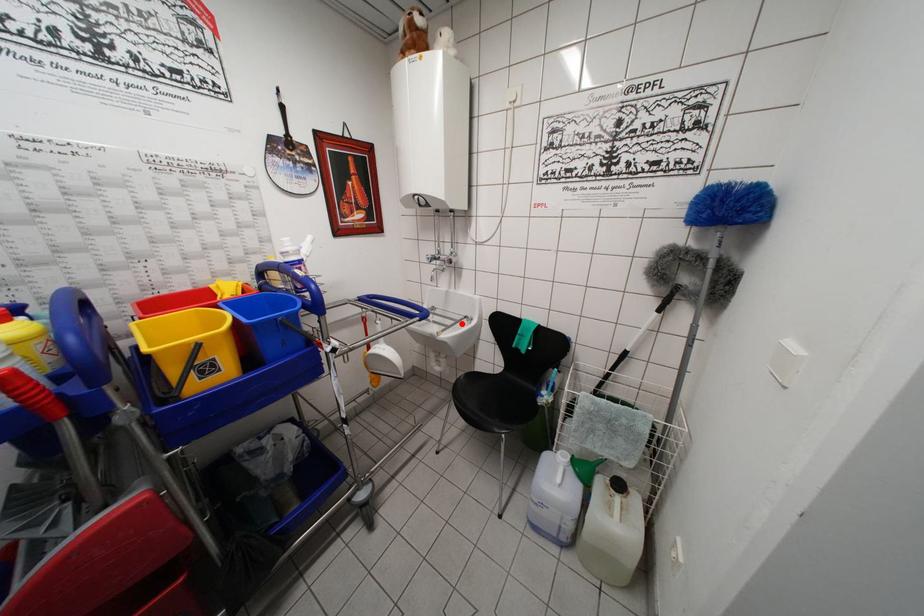
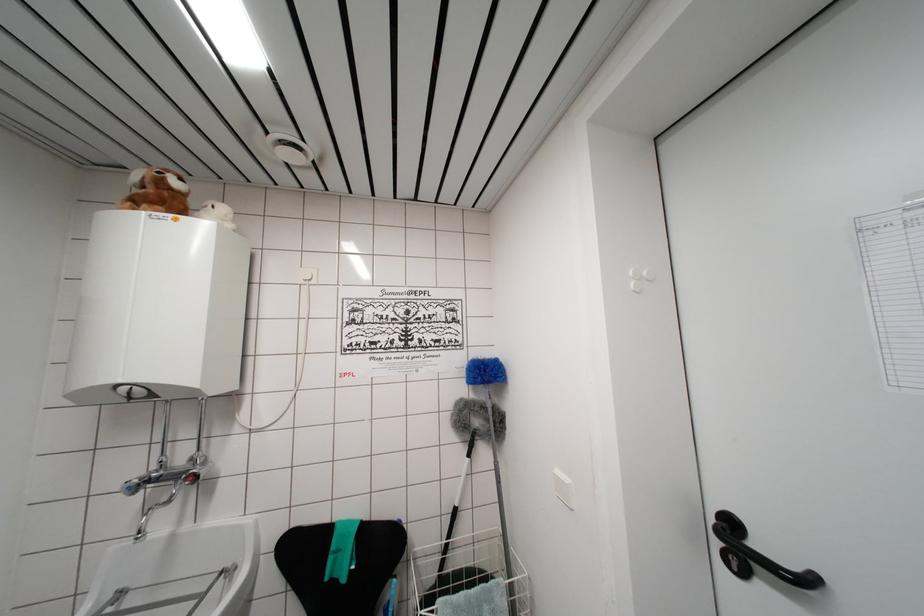
Find the pixel in the second image that matches the highlighted location in the first image.

(209, 593)